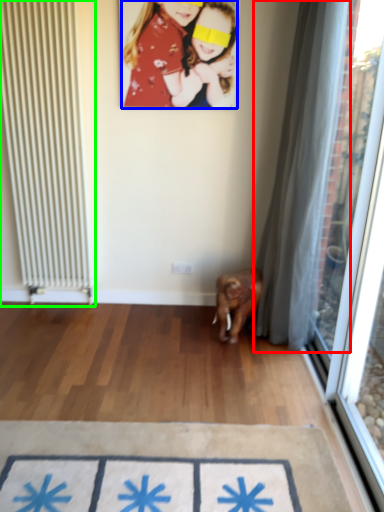
Question: Estimate the real-world distances between objects in this image. Which object is closer to curtain (highlighted by a red box), person (highlighted by a blue box) or radiator (highlighted by a green box)?

Choices:
 (A) person
 (B) radiator

Answer: (A)